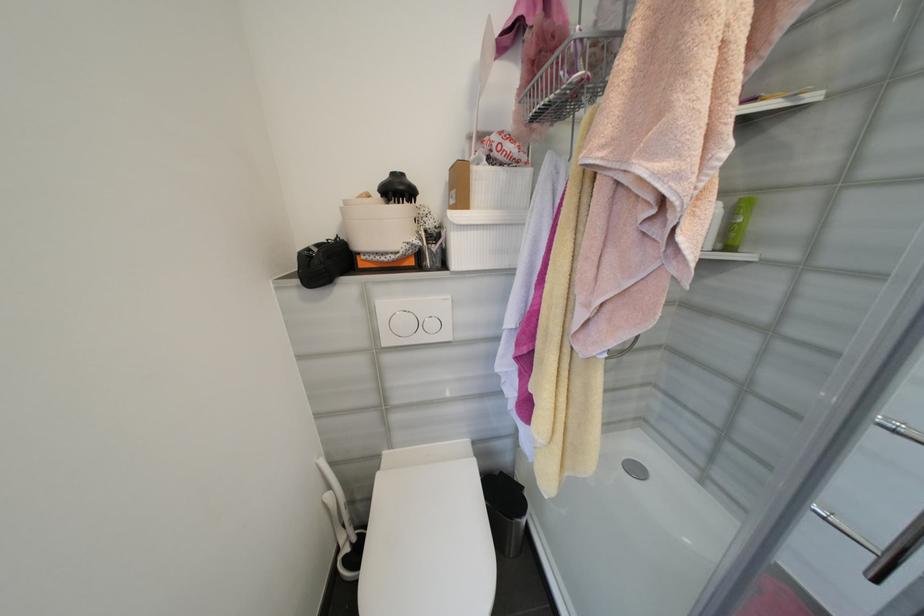
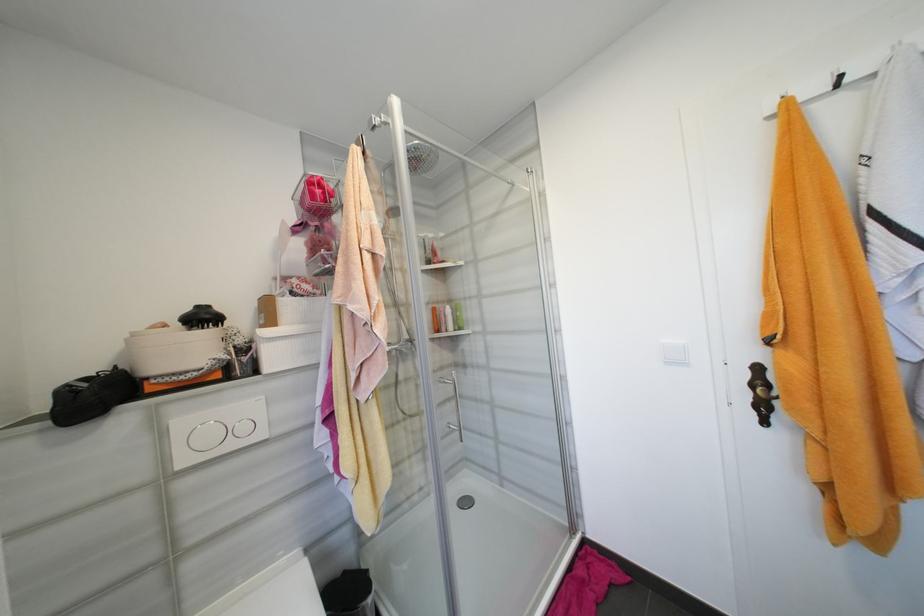
Find the pixel in the second image that matches point (351, 204) in the first image.

(140, 334)